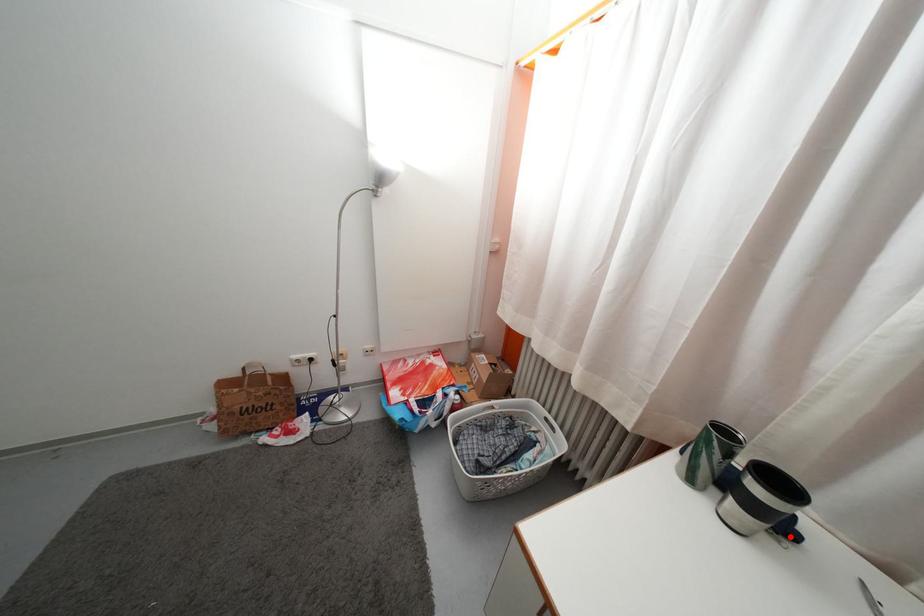
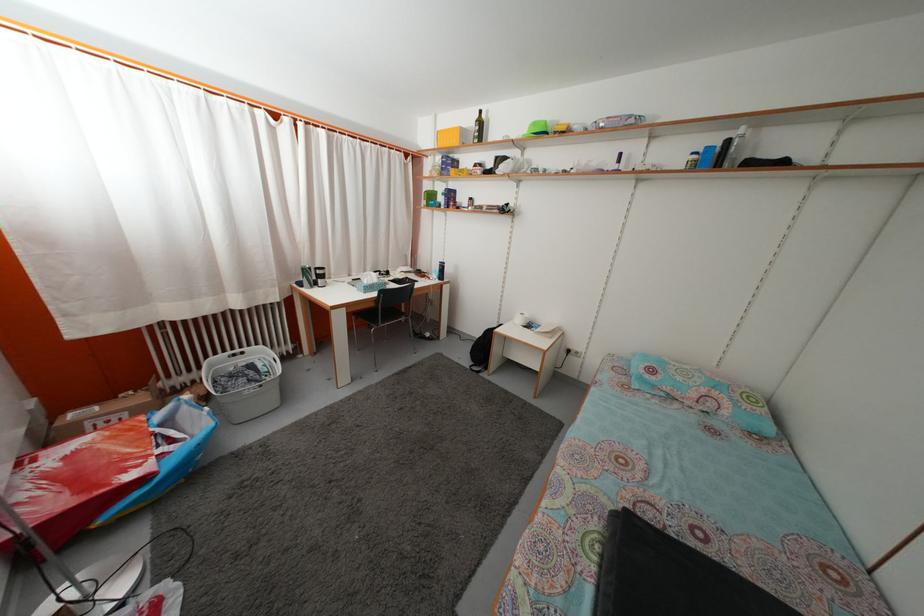
Question: I am providing you with two images of the same scene from different viewpoints. A red point is marked on the first image. Can you still see the location of the red point in image 2?

Choices:
 (A) Yes
 (B) No

Answer: (B)